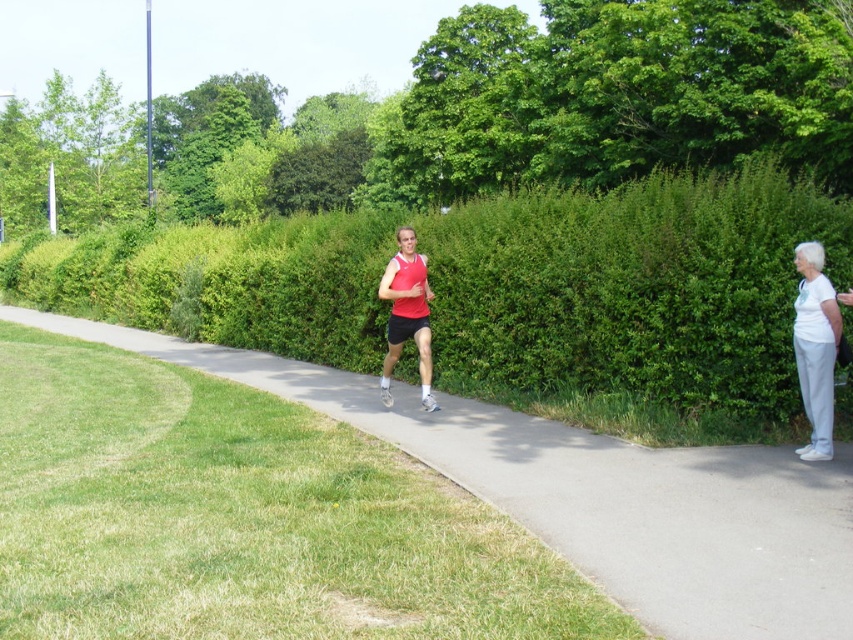
Question: Is green leafy hedge at center wider than gray asphalt pavement at center?

Choices:
 (A) no
 (B) yes

Answer: (B)

Question: Does gray asphalt pavement at center appear on the right side of matte red tank top at center?

Choices:
 (A) yes
 (B) no

Answer: (A)

Question: Which of the following is the farthest from the observer?

Choices:
 (A) (817, 445)
 (B) (846, 202)
 (C) (434, 406)
 (D) (268, 390)

Answer: (D)

Question: Which object appears closest to the camera in this image?

Choices:
 (A) white matte pants at right
 (B) gray asphalt pavement at center
 (C) green leafy hedge at center
 (D) matte red tank top at center

Answer: (B)

Question: Which of the following is the closest to the observer?

Choices:
 (A) gray asphalt pavement at center
 (B) green leafy hedge at center
 (C) matte red tank top at center

Answer: (A)

Question: Is green leafy hedge at center wider than gray asphalt pavement at center?

Choices:
 (A) yes
 (B) no

Answer: (A)